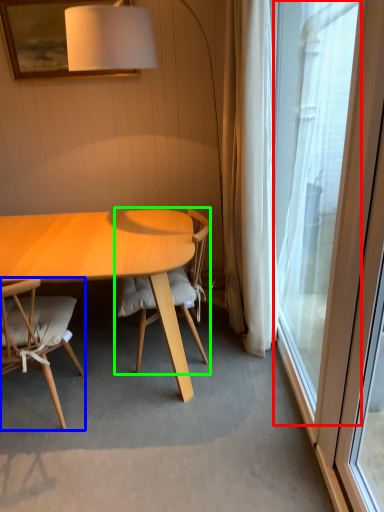
Question: Estimate the real-world distances between objects in this image. Which object is closer to window (highlighted by a red box), chair (highlighted by a blue box) or chair (highlighted by a green box)?

Choices:
 (A) chair
 (B) chair

Answer: (B)